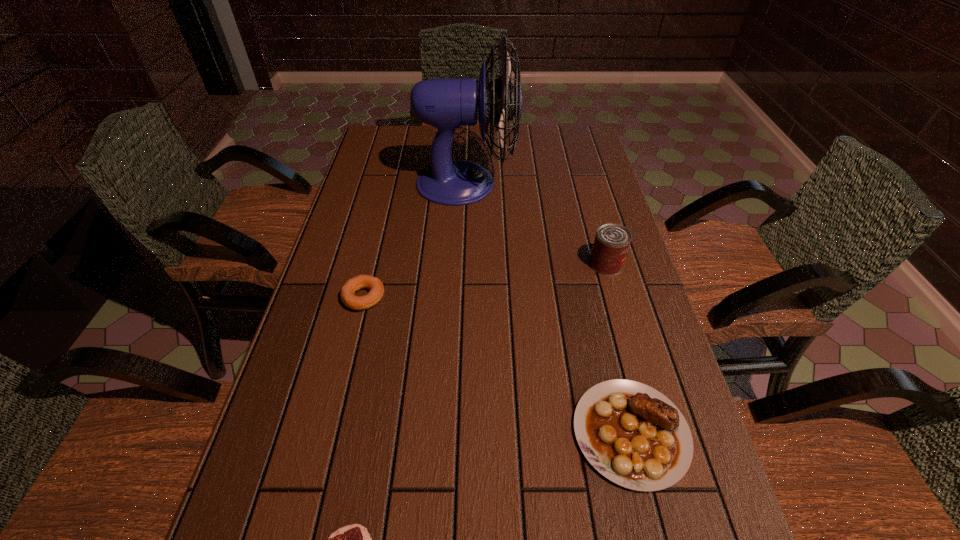
This screenshot has height=540, width=960. Identify the location of free space located 0.400m on the left of the farther steak. (365, 433).

Identify the location of vacant position located 0.350m on the front of the third nearest object. This screenshot has width=960, height=540. (324, 463).

This screenshot has width=960, height=540. I want to click on object that is at the far edge, so click(447, 103).

At what (x,y) coordinates should I click in order to perform the action: click on object that is positioned at the left edge. Please return your answer as a coordinate pair (x, y). Looking at the image, I should click on (356, 283).

This screenshot has width=960, height=540. I want to click on can situated at the right edge, so click(x=612, y=241).

This screenshot has height=540, width=960. I want to click on steak located in the right edge section of the desktop, so click(x=633, y=435).

Image resolution: width=960 pixels, height=540 pixels. In order to click on free location at the far edge of the desktop in this screenshot , I will do `click(428, 129)`.

In the image, there is a desktop. Where is `vacant space at the left edge`? Image resolution: width=960 pixels, height=540 pixels. vacant space at the left edge is located at coordinates tap(336, 352).

In the image, there is a desktop. What are the coordinates of `free region at the right edge` in the screenshot? It's located at (650, 373).

Find the location of `free location at the far left corner`. free location at the far left corner is located at coordinates (391, 155).